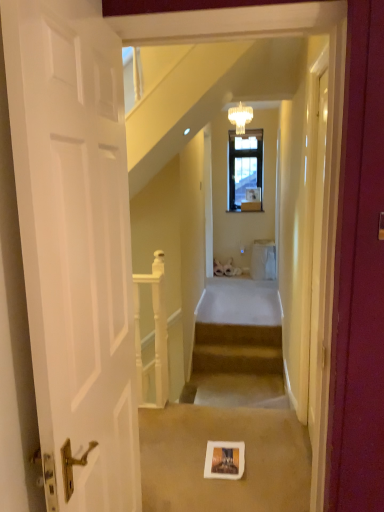
Question: From a real-world perspective, does carpeted stairs at center stand above white cardboard picture frame at center?

Choices:
 (A) yes
 (B) no

Answer: (B)

Question: Is carpeted stairs at center positioned before white cardboard picture frame at center?

Choices:
 (A) no
 (B) yes

Answer: (A)

Question: Can you confirm if carpeted stairs at center is positioned to the right of white cardboard picture frame at center?

Choices:
 (A) no
 (B) yes

Answer: (B)

Question: Is white cardboard picture frame at center at the back of carpeted stairs at center?

Choices:
 (A) yes
 (B) no

Answer: (B)

Question: Is white cardboard picture frame at center a part of carpeted stairs at center?

Choices:
 (A) yes
 (B) no

Answer: (B)

Question: Is point (231, 458) positioned closer to the camera than point (153, 371)?

Choices:
 (A) closer
 (B) farther

Answer: (A)

Question: From a real-world perspective, is white cardboard picture frame at center positioned above or below white wooden railing at center?

Choices:
 (A) below
 (B) above

Answer: (A)

Question: Is white cardboard picture frame at center spatially inside white wooden railing at center, or outside of it?

Choices:
 (A) outside
 (B) inside

Answer: (A)

Question: Is white cardboard picture frame at center bigger or smaller than white wooden railing at center?

Choices:
 (A) small
 (B) big

Answer: (A)

Question: In terms of width, does crystal glass chandelier at upper center look wider or thinner when compared to white cardboard picture frame at center?

Choices:
 (A) thin
 (B) wide

Answer: (A)

Question: Is crystal glass chandelier at upper center to the left or to the right of white cardboard picture frame at center in the image?

Choices:
 (A) left
 (B) right

Answer: (B)

Question: Is crystal glass chandelier at upper center taller or shorter than white cardboard picture frame at center?

Choices:
 (A) short
 (B) tall

Answer: (B)

Question: Based on their sizes in the image, would you say crystal glass chandelier at upper center is bigger or smaller than white cardboard picture frame at center?

Choices:
 (A) big
 (B) small

Answer: (A)

Question: Considering their positions, is carpeted stairs at center located in front of or behind white cardboard picture frame at center?

Choices:
 (A) front
 (B) behind

Answer: (B)

Question: Considering the positions of carpeted stairs at center and white cardboard picture frame at center in the image, is carpeted stairs at center taller or shorter than white cardboard picture frame at center?

Choices:
 (A) tall
 (B) short

Answer: (A)